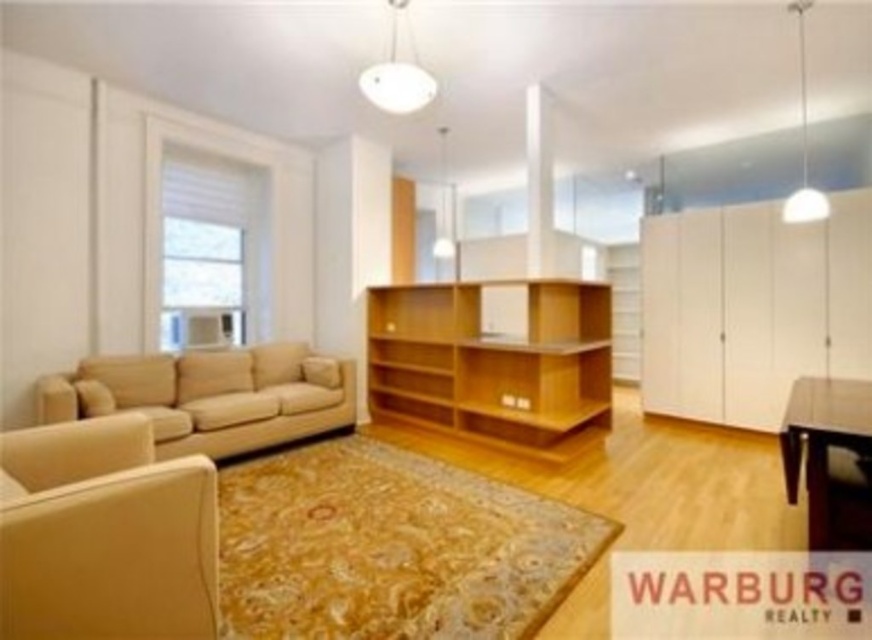
What do you see at coordinates (104, 534) in the screenshot? The height and width of the screenshot is (640, 872). I see `matte beige armchair at lower left` at bounding box center [104, 534].

Which is behind, point (2, 541) or point (438, 317)?

The point (438, 317) is behind.

Locate an element on the screen. matte beige armchair at lower left is located at coordinates (104, 534).

Where is `matte beige armchair at lower left`? The width and height of the screenshot is (872, 640). matte beige armchair at lower left is located at coordinates (104, 534).

Is matte beige armchair at lower left shorter than dark brown wooden table at lower right?

Yes.

Find the location of `matte beige armchair at lower left`. matte beige armchair at lower left is located at coordinates (104, 534).

The image size is (872, 640). In order to click on beige fabric couch at lower left in this screenshot , I will do `click(210, 396)`.

Does point (331, 397) lie in front of point (857, 433)?

No.

Who is more forward, (312,392) or (787,488)?

Point (787,488) is more forward.

Locate an element on the screen. beige fabric couch at lower left is located at coordinates click(x=210, y=396).